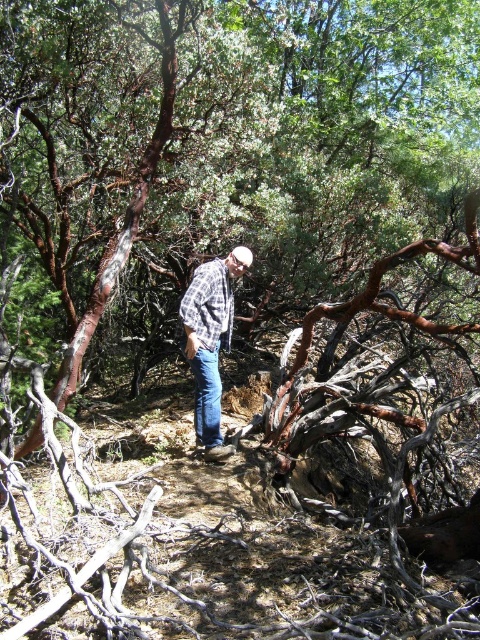
You are a hiker in the forest and see the brown rough bark tree at center and the plaid shirt at center. Which object is higher up in the scene?

The brown rough bark tree at center is located above the plaid shirt at center, so it is higher up in the scene.

You are a hiker who wants to take a photo of the plaid shirt at center and the brown rough bark tree at center. Which object should you focus on first to ensure both are in focus?

You should focus on the brown rough bark tree at center first because it is closer to the viewer than the plaid shirt at center. By focusing on the closer object, the farther one will also be in focus due to the depth of field.

You are a hiker who wants to take a photo of the brown rough bark tree at center and the plaid shirt at center. Which object should you focus on first if you want both to be in sharp focus?

The brown rough bark tree at center is taller than the plaid shirt at center, so you should focus on the brown rough bark tree at center first to ensure both are in sharp focus.